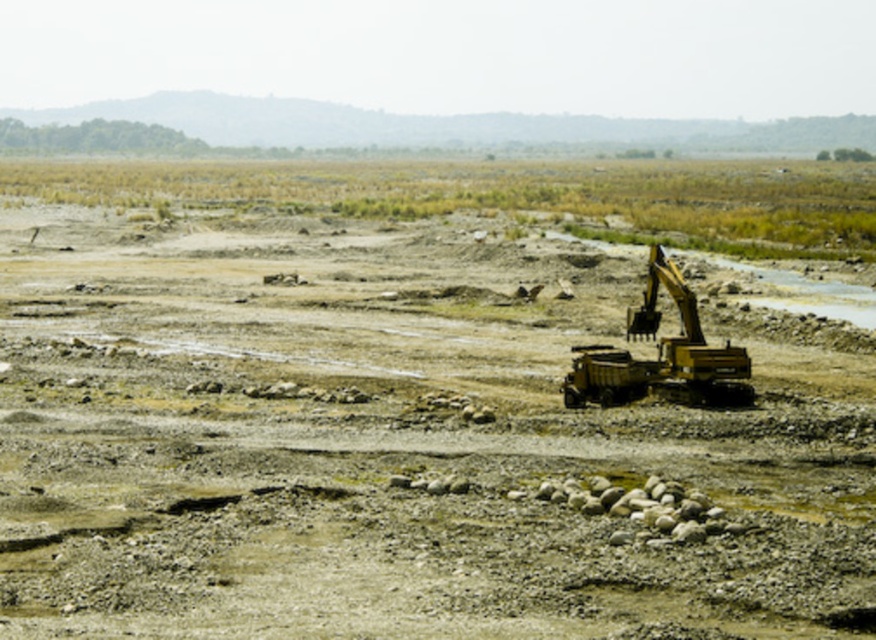
Is point (446, 282) positioned before point (613, 404)?

No, (446, 282) is behind (613, 404).

Between yellow metallic excavator at right and yellow metallic excavator at center-right, which one is positioned lower?

yellow metallic excavator at center-right

Locate an element on the screen. The width and height of the screenshot is (876, 640). yellow metallic excavator at right is located at coordinates tap(394, 445).

This screenshot has width=876, height=640. I want to click on yellow metallic excavator at right, so click(x=394, y=445).